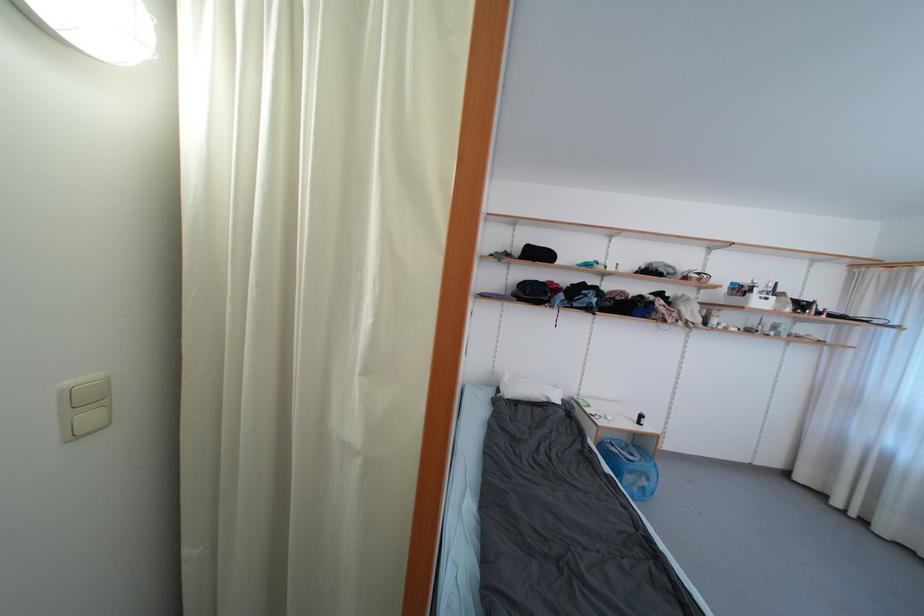
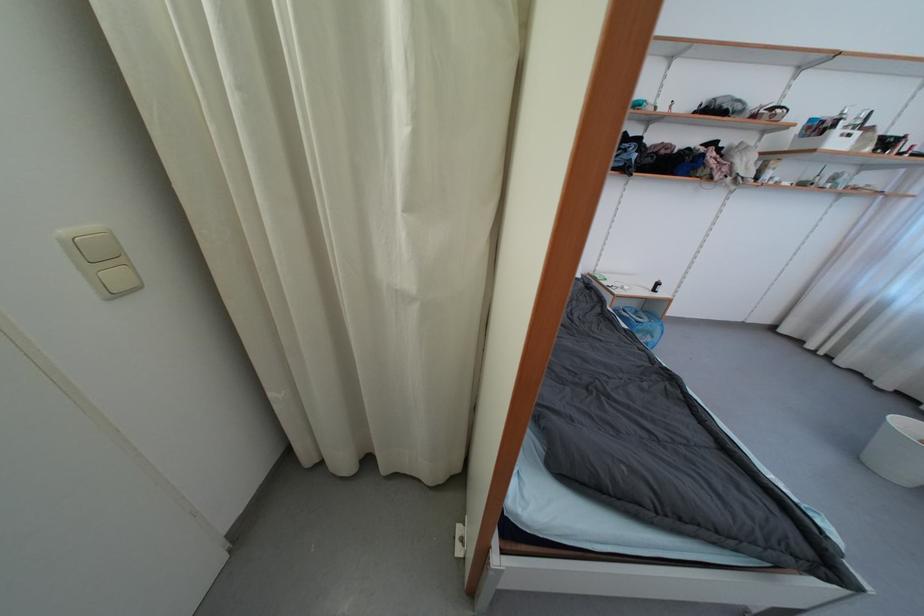
The point at (73,395) is marked in the first image. Where is the corresponding point in the second image?

(79, 246)